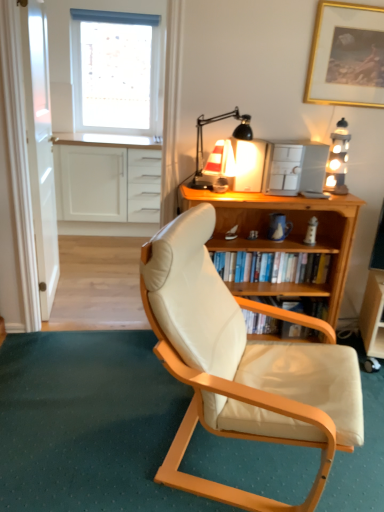
The width and height of the screenshot is (384, 512). I want to click on wooden bookshelf at center, so click(304, 268).

The width and height of the screenshot is (384, 512). Describe the element at coordinates (88, 423) in the screenshot. I see `white leather chair at center` at that location.

Measure the distance between point [54,255] and camera.

The distance of point [54,255] from camera is 2.97 meters.

The height and width of the screenshot is (512, 384). What are the coordinates of `wooden bookshelf at center` in the screenshot? It's located at (304, 268).

From a real-world perspective, is matte cream leather chair at center positioned above or below wooden bookshelf at right?

Clearly, from a real-world perspective, matte cream leather chair at center is above wooden bookshelf at right.

From the image's perspective, is matte cream leather chair at center located beneath wooden bookshelf at right?

No, from the image's perspective, matte cream leather chair at center is not below wooden bookshelf at right.

Which of these two, matte cream leather chair at center or wooden bookshelf at right, is bigger?

Bigger between the two is matte cream leather chair at center.

In order to click on table behind the matte cream leather chair at center in this screenshot , I will do `click(373, 315)`.

Is wooden bookshelf at center facing away from wooden bookshelf at center?

Yes, wooden bookshelf at center's orientation is away from wooden bookshelf at center.

From a real-world perspective, is wooden bookshelf at center on top of wooden bookshelf at center?

Yes, from a real-world perspective, wooden bookshelf at center is above wooden bookshelf at center.

How distant is wooden bookshelf at center from wooden bookshelf at center?

wooden bookshelf at center is 6.12 inches from wooden bookshelf at center.

From a real-world perspective, who is located higher, wooden bookshelf at center or wooden bookshelf at right?

wooden bookshelf at center, from a real-world perspective.

Is wooden bookshelf at center behind wooden bookshelf at right?

No, wooden bookshelf at center is closer to the camera.

Visually, is wooden bookshelf at center positioned to the left or to the right of wooden bookshelf at right?

Based on their positions, wooden bookshelf at center is located to the left of wooden bookshelf at right.

Is wooden bookshelf at right located within wooden bookshelf at center?

No, wooden bookshelf at right is located outside of wooden bookshelf at center.

Between wooden bookshelf at center and wooden bookshelf at center, which one has more height?

wooden bookshelf at center is taller.

Is wooden bookshelf at center turned away from wooden bookshelf at center?

Yes, wooden bookshelf at center is at the back of wooden bookshelf at center.

Is wooden bookshelf at center located outside wooden bookshelf at center?

Yes.

Between wooden bookshelf at center and wooden bookshelf at center, which one has larger size?

Bigger between the two is wooden bookshelf at center.

Relative to white leather chair at center, is transparent glass door at left in front or behind?

Visually, transparent glass door at left is located behind white leather chair at center.

Does transparent glass door at left appear on the left side of white leather chair at center?

Indeed, transparent glass door at left is positioned on the left side of white leather chair at center.

Is transparent glass door at left thinner than white leather chair at center?

Indeed, transparent glass door at left has a lesser width compared to white leather chair at center.

Is transparent glass door at left inside or outside of white leather chair at center?

The correct answer is: outside.

Is white matte cabinet at upper left looking in the opposite direction of wooden bookshelf at center?

No, wooden bookshelf at center is not at the back of white matte cabinet at upper left.

What's the angular difference between white matte cabinet at upper left and wooden bookshelf at center's facing directions?

white matte cabinet at upper left and wooden bookshelf at center are facing 0.657 degrees away from each other.

Does white matte cabinet at upper left have a lesser height compared to wooden bookshelf at center?

Incorrect, the height of white matte cabinet at upper left does not fall short of that of wooden bookshelf at center.

Is white matte cabinet at upper left bigger or smaller than wooden bookshelf at center?

white matte cabinet at upper left is bigger than wooden bookshelf at center.

From a real-world perspective, is transparent glass door at left positioned under matte cream leather chair at center based on gravity?

No, from a real-world perspective, transparent glass door at left is not below matte cream leather chair at center.

Does transparent glass door at left have a smaller size compared to matte cream leather chair at center?

Yes.

Identify the location of glass door that appears on the left of matte cream leather chair at center. This screenshot has height=512, width=384. (40, 150).

Find the location of a particular element. This screenshot has height=512, width=384. table beneath the matte cream leather chair at center (from a real-world perspective) is located at coordinates (373, 315).

You are a GUI agent. You are given a task and a screenshot of the screen. Output one action in this format:
    pyautogui.click(x=<x>, y=<y>)
    Task: Click on the shelf positioned vertically above the wooden bookshelf at center (from a real-world perspective)
    Image resolution: width=384 pixels, height=512 pixels.
    Given the screenshot: What is the action you would take?
    pyautogui.click(x=304, y=268)

Looking at the image, which one is located further to wooden bookshelf at center, wooden bookshelf at center or transparent glass door at left?

Among the two, transparent glass door at left is located further to wooden bookshelf at center.

Looking at the image, which one is located further to white matte window at upper left, wooden bookshelf at center or white matte cabinet at upper left?

Among the two, wooden bookshelf at center is located further to white matte window at upper left.

When comparing their distances from wooden bookshelf at center, does matte cream leather chair at center or wooden bookshelf at right seem closer?

The object closer to wooden bookshelf at center is wooden bookshelf at right.

Estimate the real-world distances between objects in this image. Which object is further from wooden bookshelf at center, transparent glass door at left or white matte window at upper left?

Among the two, white matte window at upper left is located further to wooden bookshelf at center.

Based on their spatial positions, is wooden bookshelf at right or wooden bookshelf at center further from white matte cabinet at upper left?

Among the two, wooden bookshelf at right is located further to white matte cabinet at upper left.

Based on their spatial positions, is gold-framed picture at upper right or white leather chair at center further from matte cream leather chair at center?

Among the two, gold-framed picture at upper right is located further to matte cream leather chair at center.

Estimate the real-world distances between objects in this image. Which object is closer to wooden bookshelf at right, matte black table lamp at upper center or wooden bookshelf at center?

Among the two, wooden bookshelf at center is located nearer to wooden bookshelf at right.

Estimate the real-world distances between objects in this image. Which object is further from white leather chair at center, white matte cabinet at upper left or wooden bookshelf at center?

The object further to white leather chair at center is white matte cabinet at upper left.

Where is `plain between matte cream leather chair at center and wooden bookshelf at center along the z-axis`? Image resolution: width=384 pixels, height=512 pixels. plain between matte cream leather chair at center and wooden bookshelf at center along the z-axis is located at coordinates (88, 423).

The height and width of the screenshot is (512, 384). I want to click on desk between matte black table lamp at upper center and white matte cabinet at upper left along the z-axis, so click(285, 239).

Find the location of a particular element. This screenshot has width=384, height=512. desk between white leather chair at center and wooden bookshelf at right is located at coordinates (285, 239).

I want to click on table lamp between gold-framed picture at upper right and wooden bookshelf at center vertically, so click(x=219, y=151).